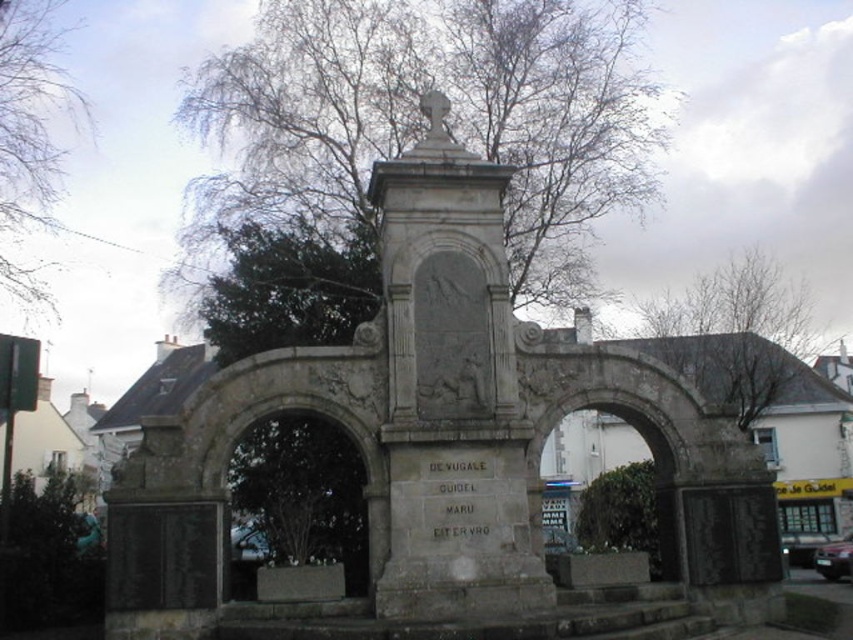
Does point (483, 232) come closer to viewer compared to point (0, 230)?

Yes.

Which of these two, stone monument at center or bare branches at upper left, stands shorter?

stone monument at center

Locate an element on the screen. This screenshot has height=640, width=853. stone monument at center is located at coordinates (440, 435).

Between point (157, 634) and point (599, 486), which one is positioned in front?

Positioned in front is point (157, 634).

Does stone monument at center have a smaller size compared to green leafy bush at center?

No, stone monument at center is not smaller than green leafy bush at center.

Who is more forward, (430, 573) or (659, 563)?

Positioned in front is point (430, 573).

At what (x,y) coordinates should I click in order to perform the action: click on stone monument at center. Please return your answer as a coordinate pair (x, y). Image resolution: width=853 pixels, height=640 pixels. Looking at the image, I should click on (440, 435).

Can you confirm if bare branches at upper center is thinner than green leafy bush at center?

In fact, bare branches at upper center might be wider than green leafy bush at center.

In the scene shown: Which of these two, bare branches at upper center or green leafy bush at center, stands taller?

Standing taller between the two is bare branches at upper center.

Between point (705, 326) and point (614, 540), which one is positioned in front?

Point (614, 540) is in front.

This screenshot has width=853, height=640. What are the coordinates of `bare branches at upper center` in the screenshot? It's located at (735, 333).